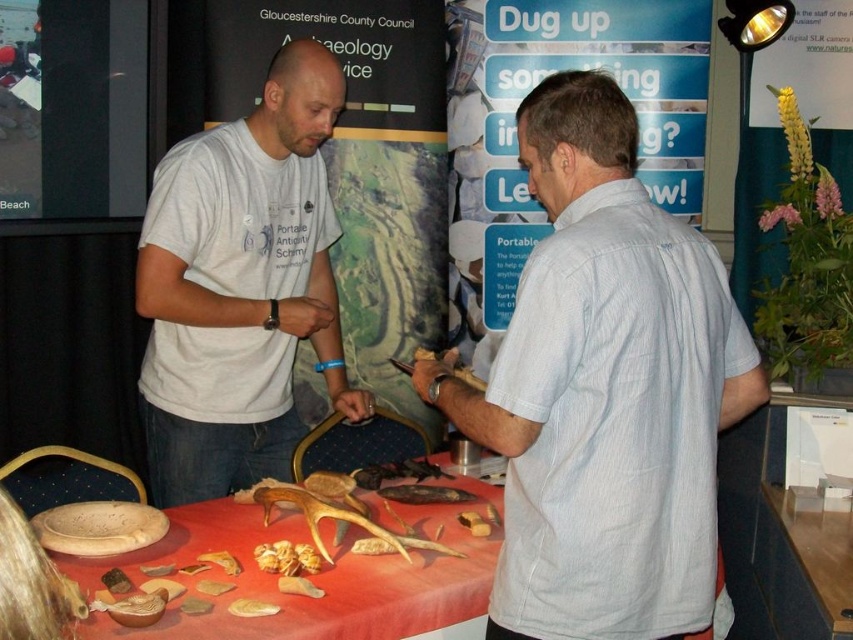
Looking at this image, you are standing in front of the archaeological exhibition table and want to reach both points on the table. Which point, point (x=334, y=122) or point (x=386, y=618), is closer to you?

Point (x=334, y=122) is closer to you because it is further to the viewer than point (x=386, y=618).